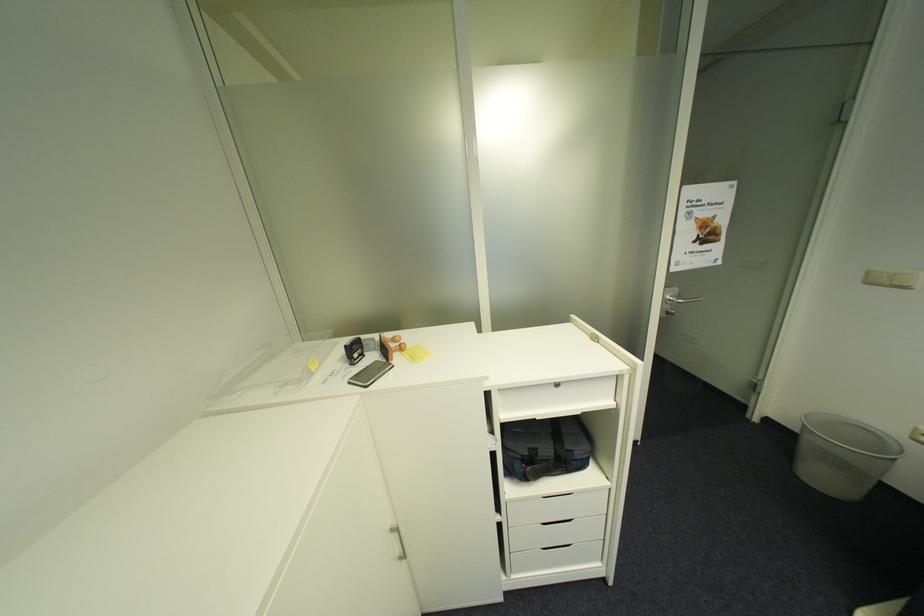
This screenshot has width=924, height=616. Describe the element at coordinates (397, 541) in the screenshot. I see `the silver cabinet handle` at that location.